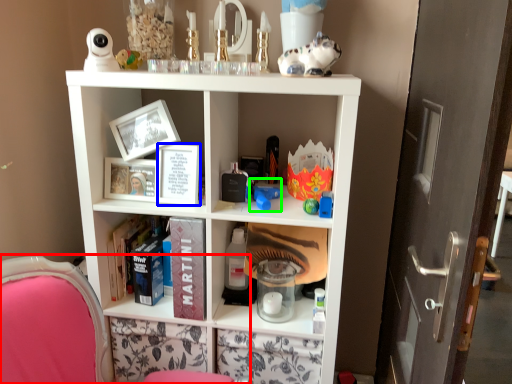
Question: Considering the real-world distances, which object is farthest from swivel chair (highlighted by a red box)? book (highlighted by a blue box) or toy (highlighted by a green box)?

Choices:
 (A) book
 (B) toy

Answer: (B)